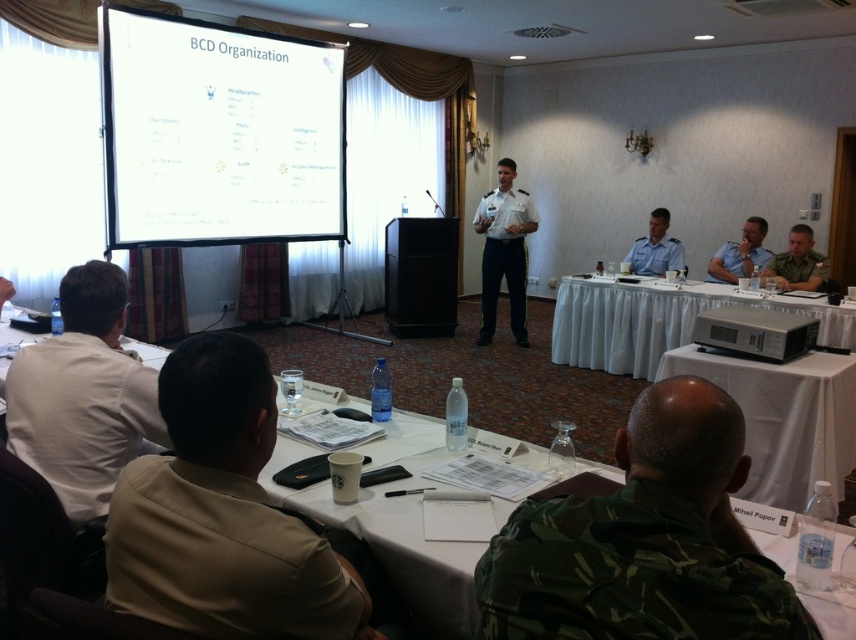
Question: Does white uniform at center appear on the right side of camouflage uniform at right?

Choices:
 (A) no
 (B) yes

Answer: (A)

Question: Among these points, which one is farthest from the camera?

Choices:
 (A) (568, 609)
 (B) (676, 298)

Answer: (B)

Question: Which point appears farthest from the camera in this image?

Choices:
 (A) (753, 257)
 (B) (645, 252)
 (C) (174, 196)
 (D) (783, 289)

Answer: (B)

Question: Can you confirm if white matte projection screen at upper center is positioned below tan uniform at lower left?

Choices:
 (A) yes
 (B) no

Answer: (B)

Question: Among these points, which one is nearest to the camera?

Choices:
 (A) (628, 266)
 (B) (446, 570)
 (C) (752, 262)

Answer: (B)

Question: Is camouflage fabric uniform at lower right bigger than white matte projection screen at upper center?

Choices:
 (A) yes
 (B) no

Answer: (B)